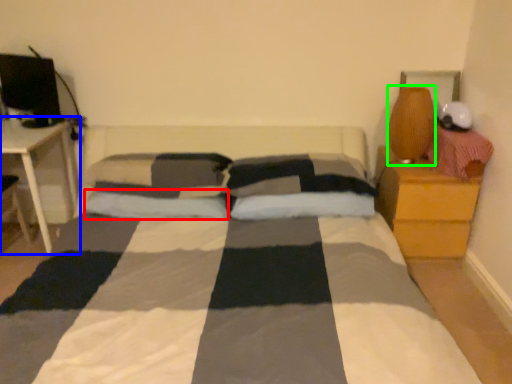
Question: Considering the real-world distances, which object is farthest from pillow (highlighted by a red box)? table (highlighted by a blue box) or table lamp (highlighted by a green box)?

Choices:
 (A) table
 (B) table lamp

Answer: (B)